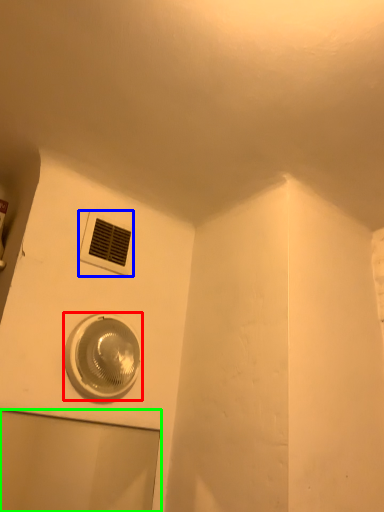
Question: Which object is positioned closest to home appliance (highlighted by a red box)? Select from air conditioning (highlighted by a blue box) and glass door (highlighted by a green box).

Choices:
 (A) air conditioning
 (B) glass door

Answer: (A)